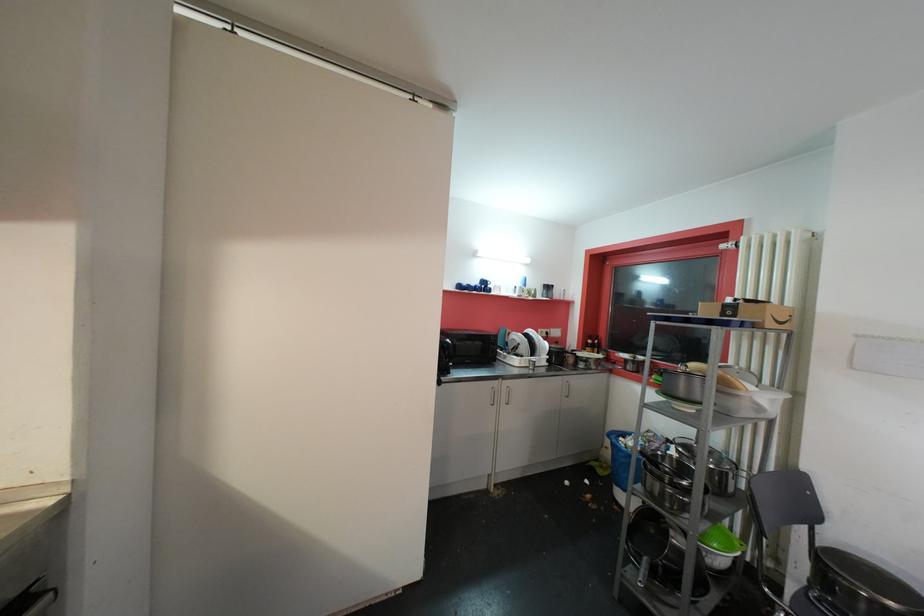
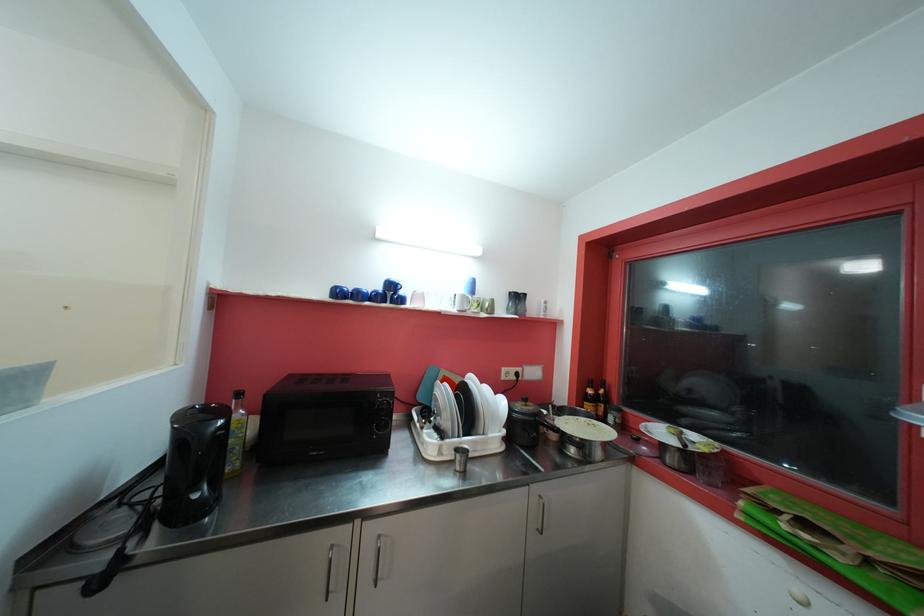
Where in the second image is the point corresponding to the point at 633,370 from the first image?

(675, 462)